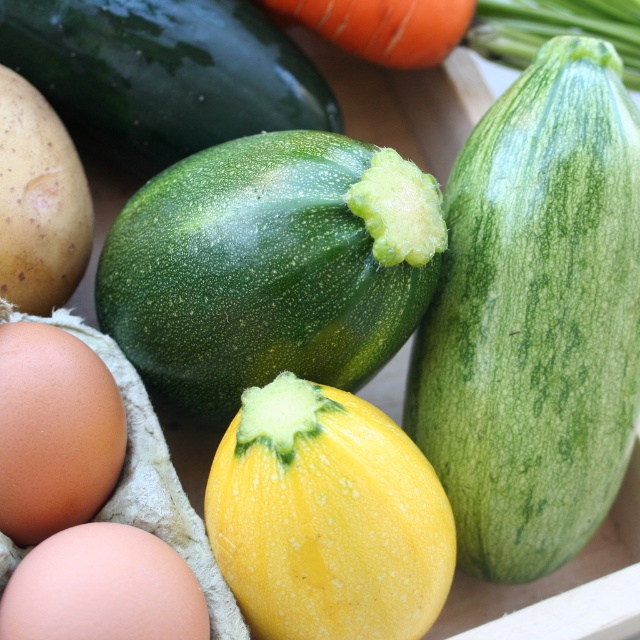
Who is positioned more to the left, green matte zucchini at center or green matte zucchini at upper center?

Positioned to the left is green matte zucchini at upper center.

Is green matte zucchini at center shorter than green matte zucchini at upper center?

In fact, green matte zucchini at center may be taller than green matte zucchini at upper center.

Describe the element at coordinates (269, 266) in the screenshot. This screenshot has height=640, width=640. I see `green matte zucchini at center` at that location.

Identify the location of green matte zucchini at center. (269, 266).

In the scene shown: Who is lower down, green matte zucchini at upper center or orange smooth carrot at upper center?

green matte zucchini at upper center is lower down.

Which is behind, point (156, 129) or point (301, 1)?

The point (301, 1) is behind.

The image size is (640, 640). What are the coordinates of `green matte zucchini at upper center` in the screenshot? It's located at (163, 74).

Does point (220, 557) come closer to viewer compared to point (122, 461)?

Yes.

Between point (304, 541) and point (6, 404), which one is positioned in front?

Point (6, 404) is more forward.

Is point (349, 432) less distant than point (77, 467)?

Yes, point (349, 432) is in front of point (77, 467).

Locate an element on the screen. yellow matte squash at center is located at coordinates (326, 516).